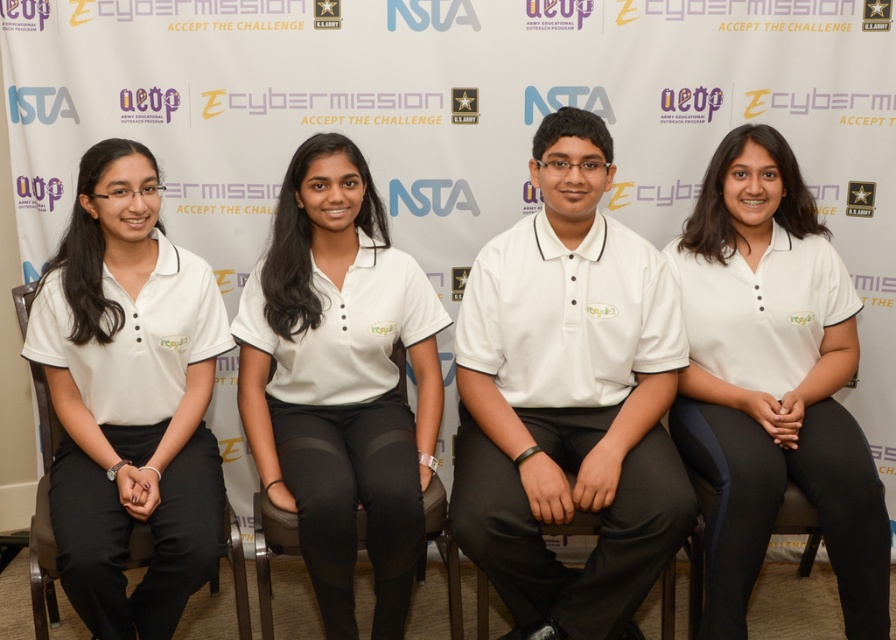
Which is more to the right, white cotton shirt at center or white matte uniform at center?

Positioned to the right is white cotton shirt at center.

Does white cotton shirt at center lie in front of white matte uniform at center?

No, white cotton shirt at center is further to the viewer.

Who is more forward, (602, 184) or (349, 275)?

Point (602, 184)

Image resolution: width=896 pixels, height=640 pixels. I want to click on white cotton shirt at center, so click(567, 400).

The height and width of the screenshot is (640, 896). What are the coordinates of `white matte polo shirt at right` in the screenshot? It's located at (772, 381).

Is point (815, 422) closer to camera compared to point (130, 291)?

No.

Is point (688, 419) positioned behind point (171, 428)?

Yes, point (688, 419) is behind point (171, 428).

Find the location of a particular element. Image resolution: width=896 pixels, height=640 pixels. white matte polo shirt at right is located at coordinates pyautogui.click(x=772, y=381).

Describe the element at coordinates (567, 400) in the screenshot. I see `white cotton shirt at center` at that location.

Which of these two, white cotton shirt at center or white matte shirt at left, stands shorter?

white matte shirt at left

Between point (564, 420) and point (165, 378), which one is positioned behind?

Positioned behind is point (564, 420).

This screenshot has height=640, width=896. In order to click on white cotton shirt at center in this screenshot , I will do `click(567, 400)`.